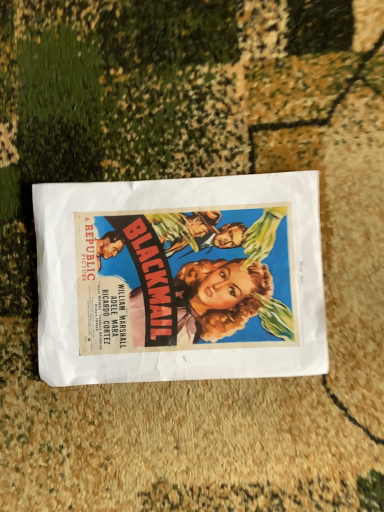
Locate an element on the screen. The image size is (384, 512). matte paper poster at center is located at coordinates (180, 279).

What do you see at coordinates (180, 279) in the screenshot?
I see `matte paper poster at center` at bounding box center [180, 279].

Locate an element on the screen. This screenshot has width=384, height=512. matte paper poster at center is located at coordinates (180, 279).